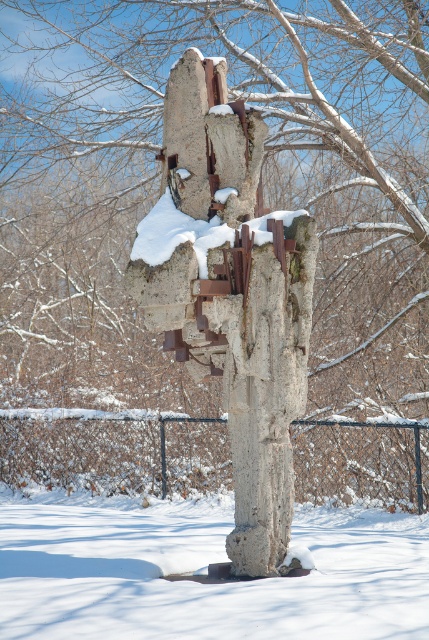
Question: Considering the relative positions of rusty concrete sculpture at center and white powdery snow at lower center in the image provided, where is rusty concrete sculpture at center located with respect to white powdery snow at lower center?

Choices:
 (A) above
 (B) below

Answer: (A)

Question: Which point is closer to the camera taking this photo?

Choices:
 (A) (326, 509)
 (B) (120, 429)
 (C) (256, 545)

Answer: (C)

Question: Which point is closer to the camera taking this photo?

Choices:
 (A) [337, 589]
 (B) [168, 225]
 (C) [308, 310]
 (D) [53, 452]

Answer: (A)

Question: Can you confirm if black chain-link fence at center is bigger than white frosty snow at center?

Choices:
 (A) no
 (B) yes

Answer: (B)

Question: Which object is closer to the camera taking this photo?

Choices:
 (A) white powdery snow at lower center
 (B) white frosty snow at center

Answer: (A)

Question: Can you confirm if white powdery snow at lower center is positioned to the left of white frosty snow at center?

Choices:
 (A) yes
 (B) no

Answer: (A)